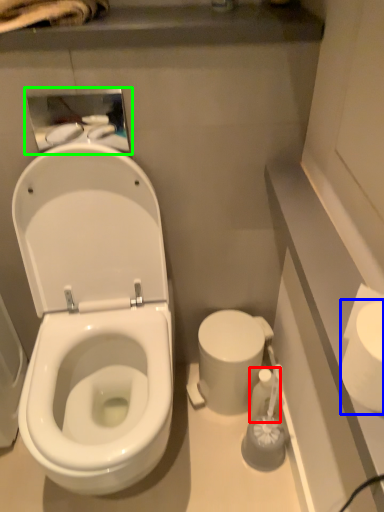
Question: Considering the real-world distances, which object is closest to toiletry (highlighted by a red box)? toilet paper (highlighted by a blue box) or medicine cabinet (highlighted by a green box).

Choices:
 (A) toilet paper
 (B) medicine cabinet

Answer: (A)